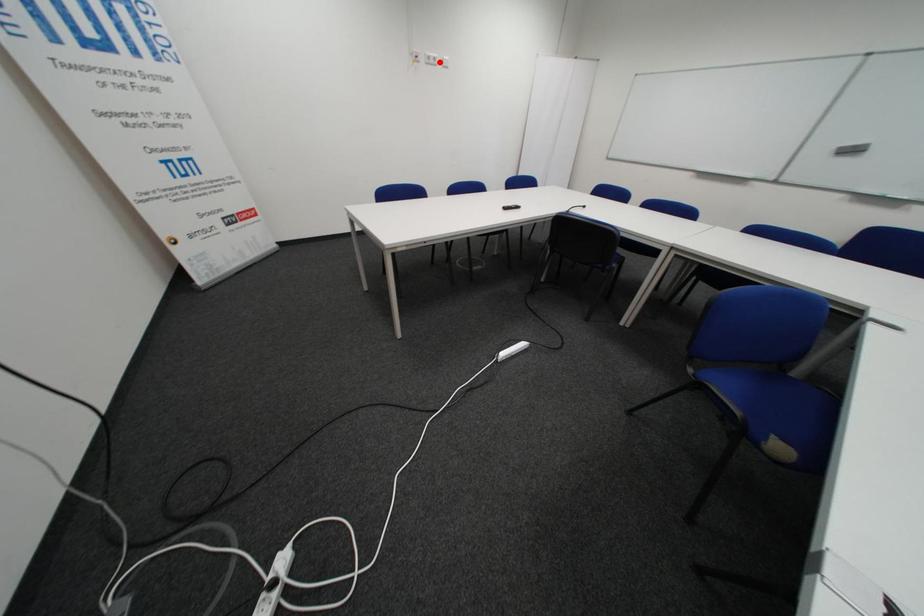
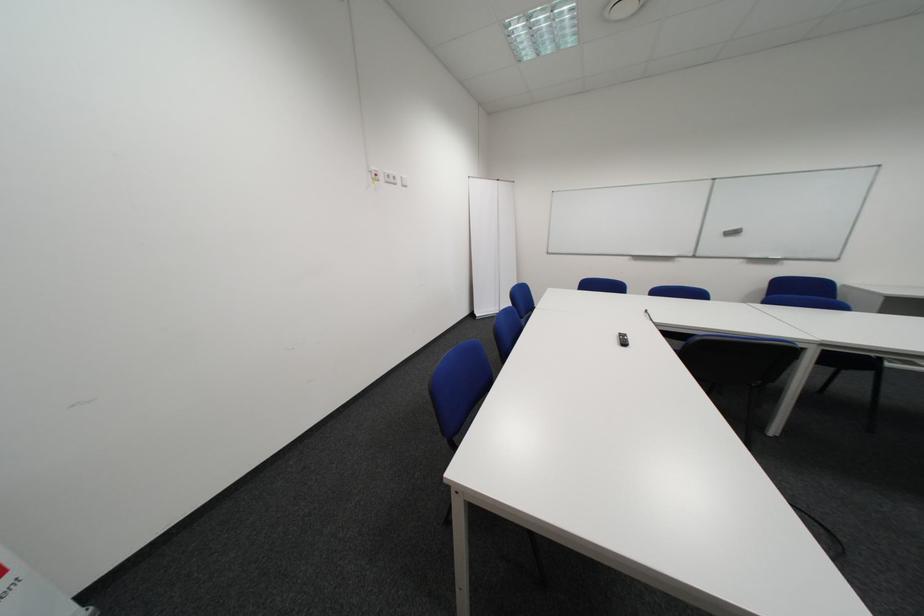
The point at the highlighted location is marked in the first image. Where is the corresponding point in the second image?

(398, 180)